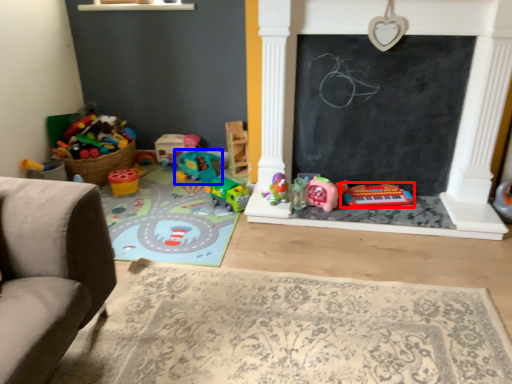
Question: Which object is further to the camera taking this photo, toy (highlighted by a red box) or toy (highlighted by a blue box)?

Choices:
 (A) toy
 (B) toy

Answer: (B)